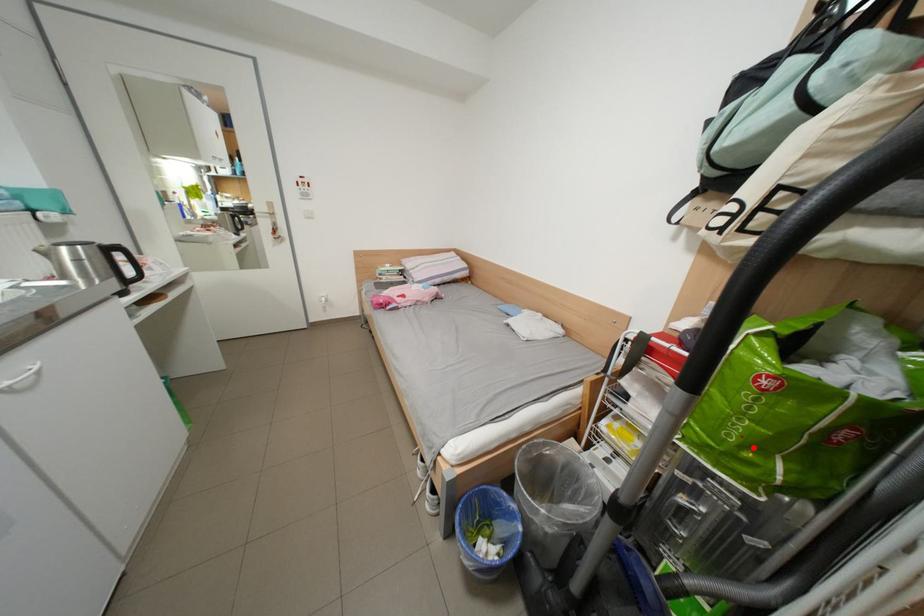
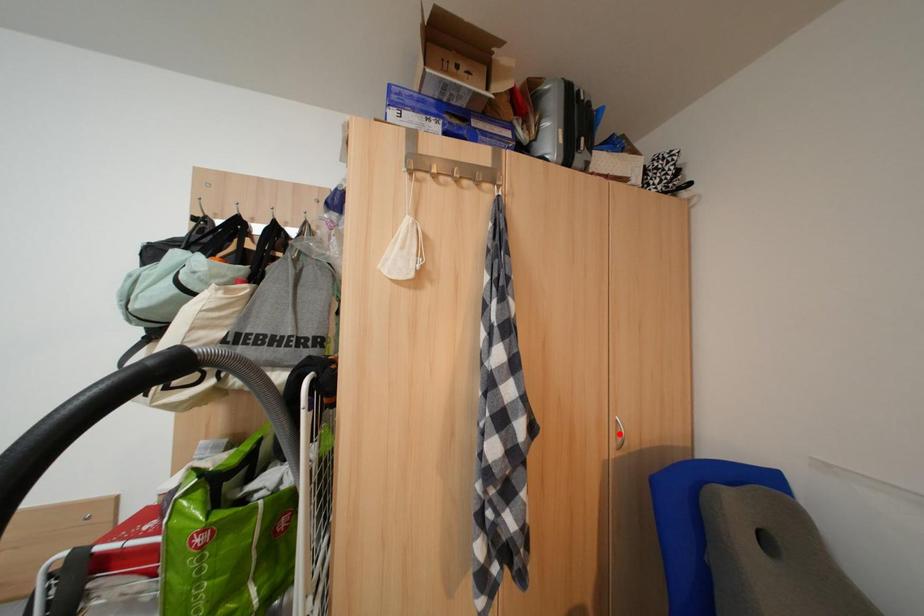
I am providing you with two images of the same scene from different viewpoints. A red point is marked on the first image and another point is marked on the second image. Do the highlighted points in image1 and image2 indicate the same real-world spot?

No